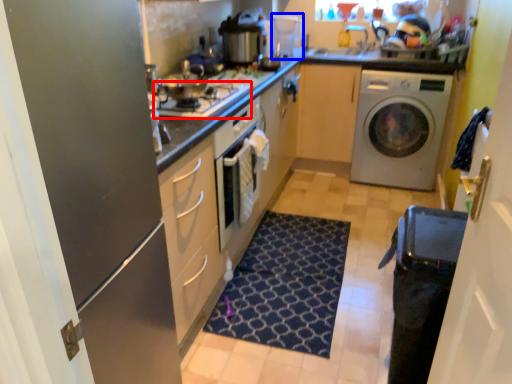
Question: Among these objects, which one is farthest to the camera, gas stove (highlighted by a red box) or coffee machine (highlighted by a blue box)?

Choices:
 (A) gas stove
 (B) coffee machine

Answer: (B)